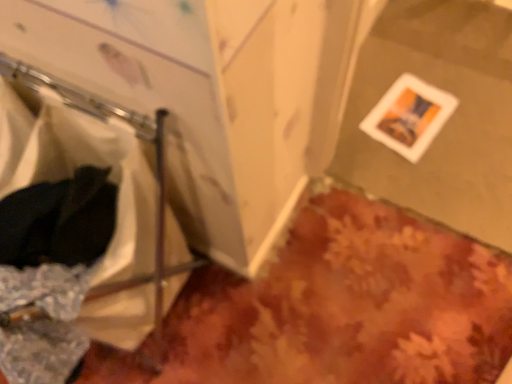
At what (x,y) coordinates should I click in order to perform the action: click on white matte picture frame at lower right. Please return your answer as a coordinate pair (x, y). The width and height of the screenshot is (512, 384). Looking at the image, I should click on (409, 116).

What do you see at coordinates (409, 116) in the screenshot? I see `white matte picture frame at lower right` at bounding box center [409, 116].

From the picture: What is the approximate width of white fabric laundry at left?

18.36 inches.

Find the location of a particular element. white fabric laundry at left is located at coordinates (51, 268).

Describe the element at coordinates (51, 268) in the screenshot. I see `white fabric laundry at left` at that location.

At what (x,y) coordinates should I click in order to perform the action: click on white matte picture frame at lower right. Please return your answer as a coordinate pair (x, y). Image resolution: width=512 pixels, height=384 pixels. Looking at the image, I should click on (409, 116).

Based on the photo, considering the positions of objects white matte picture frame at lower right and white fabric laundry at left in the image provided, who is more to the right, white matte picture frame at lower right or white fabric laundry at left?

From the viewer's perspective, white matte picture frame at lower right appears more on the right side.

Is the position of white matte picture frame at lower right less distant than that of white fabric laundry at left?

No, it is behind white fabric laundry at left.

Which is closer, (406, 141) or (79, 228)?

Point (406, 141) is positioned farther from the camera compared to point (79, 228).

From the image's perspective, is white matte picture frame at lower right below white fabric laundry at left?

No.

Consider the image. From a real-world perspective, which is physically above, white matte picture frame at lower right or white fabric laundry at left?

white fabric laundry at left is physically above.

Can you confirm if white matte picture frame at lower right is wider than white fabric laundry at left?

In fact, white matte picture frame at lower right might be narrower than white fabric laundry at left.

Considering the relative sizes of white matte picture frame at lower right and white fabric laundry at left in the image provided, is white matte picture frame at lower right shorter than white fabric laundry at left?

Correct, white matte picture frame at lower right is not as tall as white fabric laundry at left.

Between white matte picture frame at lower right and white fabric laundry at left, which one has smaller size?

Smaller between the two is white matte picture frame at lower right.

Is white matte picture frame at lower right spatially inside white fabric laundry at left, or outside of it?

white matte picture frame at lower right lies outside white fabric laundry at left.

Is white matte picture frame at lower right touching white fabric laundry at left?

There is a gap between white matte picture frame at lower right and white fabric laundry at left.

Is white matte picture frame at lower right oriented towards white fabric laundry at left?

No, white matte picture frame at lower right is not turned towards white fabric laundry at left.

The width and height of the screenshot is (512, 384). I want to click on picture frame that is under the white fabric laundry at left (from a real-world perspective), so click(x=409, y=116).

Can you confirm if white fabric laundry at left is positioned to the left of white matte picture frame at lower right?

Indeed, white fabric laundry at left is positioned on the left side of white matte picture frame at lower right.

Consider the image. Is white fabric laundry at left in front of or behind white matte picture frame at lower right in the image?

Visually, white fabric laundry at left is located in front of white matte picture frame at lower right.

Considering the positions of points (58, 231) and (387, 124), is point (58, 231) closer to camera compared to point (387, 124)?

Yes, point (58, 231) is in front of point (387, 124).

From the image's perspective, does white fabric laundry at left appear higher than white matte picture frame at lower right?

Incorrect, from the image's perspective, white fabric laundry at left is lower than white matte picture frame at lower right.

From a real-world perspective, is white fabric laundry at left positioned under white matte picture frame at lower right based on gravity?

No.

Does white fabric laundry at left have a lesser width compared to white matte picture frame at lower right?

Incorrect, the width of white fabric laundry at left is not less than that of white matte picture frame at lower right.

Looking at this image, between white fabric laundry at left and white matte picture frame at lower right, which one has more height?

Standing taller between the two is white fabric laundry at left.

In terms of size, does white fabric laundry at left appear bigger or smaller than white matte picture frame at lower right?

Considering their sizes, white fabric laundry at left takes up more space than white matte picture frame at lower right.

Is white matte picture frame at lower right inside white fabric laundry at left?

No, white matte picture frame at lower right is not surrounded by white fabric laundry at left.

Is white fabric laundry at left next to white matte picture frame at lower right?

No, white fabric laundry at left is not beside white matte picture frame at lower right.

Is white matte picture frame at lower right at the back of white fabric laundry at left?

Yes.

How different are the orientations of white fabric laundry at left and white matte picture frame at lower right in degrees?

There is a 9-degree angle between the facing directions of white fabric laundry at left and white matte picture frame at lower right.

Where is `laundry that appears on the left of white matte picture frame at lower right`? laundry that appears on the left of white matte picture frame at lower right is located at coordinates (51, 268).

The image size is (512, 384). I want to click on laundry that is on the left side of white matte picture frame at lower right, so click(x=51, y=268).

Identify the location of laundry located in front of the white matte picture frame at lower right. The width and height of the screenshot is (512, 384). (51, 268).